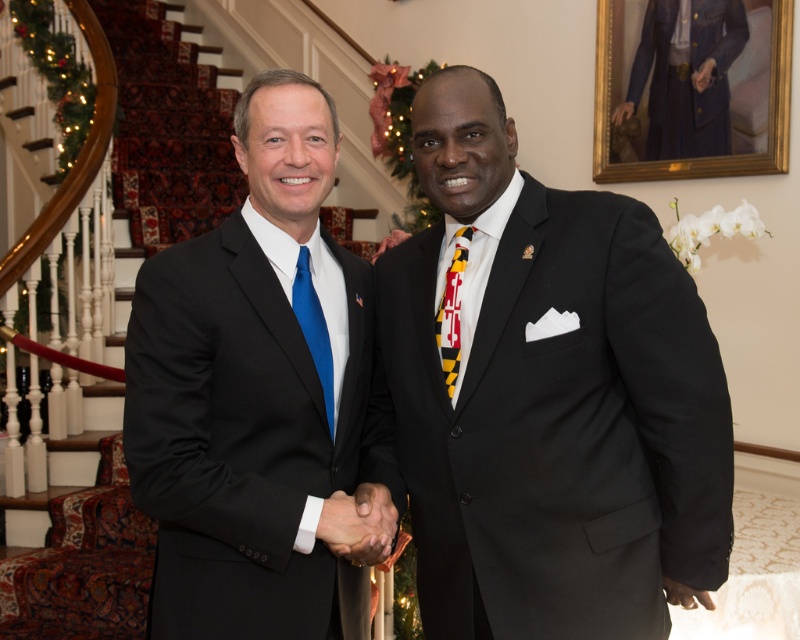
Question: Is black satin suit at center bigger than matte black suit at center?

Choices:
 (A) yes
 (B) no

Answer: (A)

Question: Which is farther from the blue silk tie at center?

Choices:
 (A) matte black suit at center
 (B) black satin suit at center
 (C) smooth leather hand at center

Answer: (B)

Question: Considering the real-world distances, which object is farthest from the matte black suit at center?

Choices:
 (A) black satin suit at center
 (B) yellow and black striped tie at center
 (C) smooth leather hand at center

Answer: (B)

Question: Observing the image, what is the correct spatial positioning of matte black suit at center in reference to yellow and black striped tie at center?

Choices:
 (A) right
 (B) left

Answer: (B)

Question: Is smooth leather hand at center positioned behind yellow and black striped tie at center?

Choices:
 (A) yes
 (B) no

Answer: (B)

Question: Which object appears farthest from the camera in this image?

Choices:
 (A) blue silk tie at center
 (B) black satin suit at center

Answer: (A)